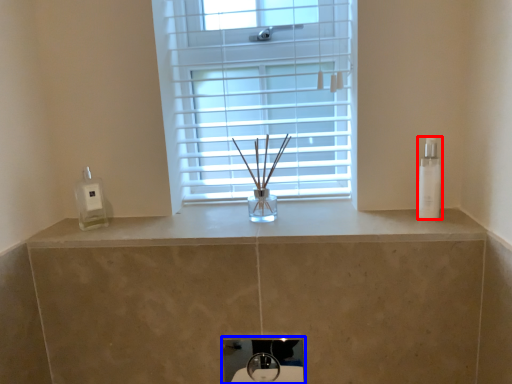
Question: Among these objects, which one is farthest to the camera, toiletry (highlighted by a red box) or sink (highlighted by a blue box)?

Choices:
 (A) toiletry
 (B) sink

Answer: (B)